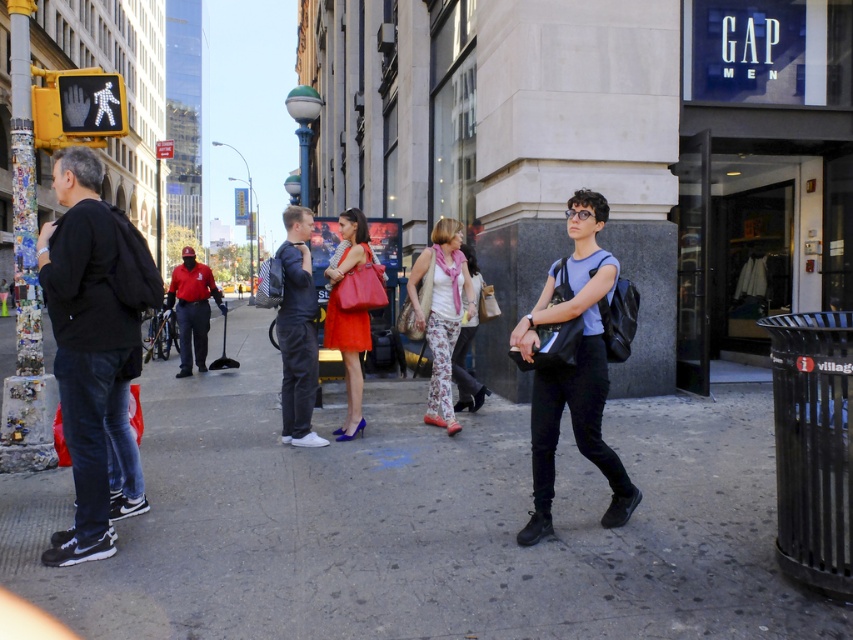
Is concrete sidewalk at center smaller than red uniform at center?

No.

Is concrete sidewalk at center shorter than red uniform at center?

Indeed, concrete sidewalk at center has a lesser height compared to red uniform at center.

What do you see at coordinates (418, 522) in the screenshot? The image size is (853, 640). I see `concrete sidewalk at center` at bounding box center [418, 522].

Find the location of a particular element. The width and height of the screenshot is (853, 640). concrete sidewalk at center is located at coordinates (418, 522).

Does matte black backpack at center appear under red uniform at center?

Indeed, matte black backpack at center is positioned under red uniform at center.

Can you confirm if matte black backpack at center is positioned to the left of red uniform at center?

No, matte black backpack at center is not to the left of red uniform at center.

Does point (602, 196) come in front of point (201, 316)?

Yes, point (602, 196) is in front of point (201, 316).

Image resolution: width=853 pixels, height=640 pixels. Find the location of `matte black backpack at center`. matte black backpack at center is located at coordinates (572, 368).

Does matte red handbag at center lie behind red uniform at center?

No, matte red handbag at center is closer to the viewer.

Based on the photo, can you confirm if matte red handbag at center is wider than red uniform at center?

Incorrect, matte red handbag at center's width does not surpass red uniform at center's.

At what (x,y) coordinates should I click in order to perform the action: click on matte red handbag at center. Please return your answer as a coordinate pair (x, y). This screenshot has width=853, height=640. Looking at the image, I should click on (347, 316).